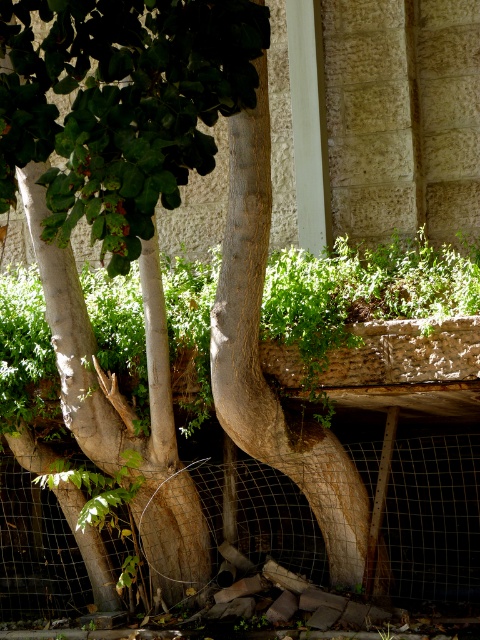
Question: Among these points, which one is farthest from the camera?

Choices:
 (A) (54, 401)
 (B) (469, 440)

Answer: (B)

Question: Is wire mesh fence at lower center behind brown rough bark at center?

Choices:
 (A) yes
 (B) no

Answer: (A)

Question: Estimate the real-world distances between objects in this image. Which object is closer to the wire mesh fence at lower center?

Choices:
 (A) brown rough bark at center
 (B) green leafy plant at center

Answer: (A)

Question: Does green leafy plant at center appear on the left side of brown rough bark at center?

Choices:
 (A) yes
 (B) no

Answer: (B)

Question: Which of the following is the farthest from the observer?

Choices:
 (A) (236, 122)
 (B) (189, 356)

Answer: (B)

Question: Is wire mesh fence at lower center above brown rough bark at center?

Choices:
 (A) no
 (B) yes

Answer: (A)